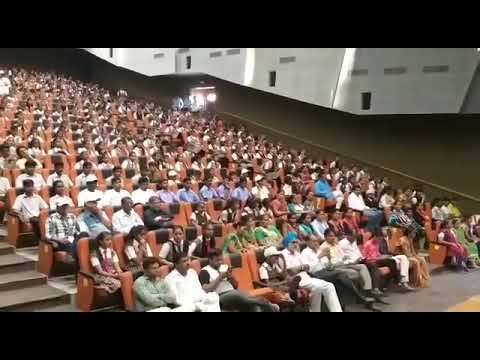
At what (x,y) coordinates should I click in order to perform the action: click on hand rail. Please return your answer as a coordinate pair (x, y). Looking at the image, I should click on (420, 181).